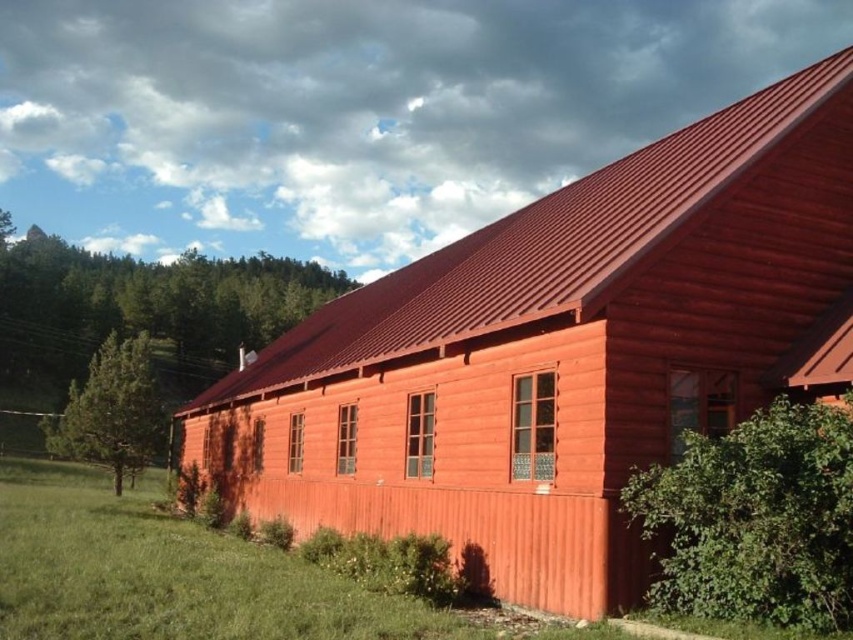
You are standing in front of the rustic red wooden building looking towards the lawn. Which object, the metallic red roof at upper center or the green leafy bush at lower right, is positioned to the left when viewed from your perspective?

The metallic red roof at upper center is positioned to the left of the green leafy bush at lower right from your perspective.

You are standing in front of the rustic red wooden building and want to place a small garden ornament between the green leafy bush at lower right and the green textured pine tree at left. Based on their positions, which object should the ornament be closer to?

The ornament should be placed closer to the green leafy bush at lower right because it is closer to the viewer compared to the green textured pine tree at left.

You are standing in front of the rustic red wooden building. You notice a green leafy bush at lower right and a green textured pine tree at left. Which of these two plants is positioned higher up in the image?

The green leafy bush at lower right is positioned higher up in the image than the green textured pine tree at left according to the description.